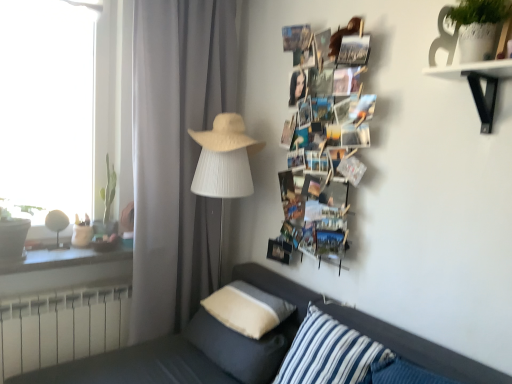
Question: Is soft beige pillow at lower center, positioned as the 2th pillow in front-to-back order, at the left side of matte white table lamp at left, which is the 2th table lamp in right-to-left order?

Choices:
 (A) yes
 (B) no

Answer: (B)

Question: Is soft beige pillow at lower center, positioned as the 2th pillow in front-to-back order, next to matte white table lamp at left, placed as the 1th table lamp when sorted from left to right?

Choices:
 (A) yes
 (B) no

Answer: (B)

Question: Does soft beige pillow at lower center, positioned as the 2th pillow in front-to-back order, contain matte white table lamp at left, which is the 2th table lamp in right-to-left order?

Choices:
 (A) yes
 (B) no

Answer: (B)

Question: Does soft beige pillow at lower center, the second pillow when ordered from back to front, come in front of matte white table lamp at left, which is the 2th table lamp in right-to-left order?

Choices:
 (A) no
 (B) yes

Answer: (B)

Question: Is soft beige pillow at lower center, positioned as the 2th pillow in front-to-back order, wider than matte white table lamp at left, placed as the 1th table lamp when sorted from left to right?

Choices:
 (A) yes
 (B) no

Answer: (A)

Question: Is gray matte curtain at center spatially inside matte wood window sill at left, or outside of it?

Choices:
 (A) outside
 (B) inside

Answer: (A)

Question: In terms of size, does gray matte curtain at center appear bigger or smaller than matte wood window sill at left?

Choices:
 (A) small
 (B) big

Answer: (B)

Question: From the image's perspective, is gray matte curtain at center located above or below matte wood window sill at left?

Choices:
 (A) above
 (B) below

Answer: (A)

Question: From a real-world perspective, is gray matte curtain at center physically located above or below matte wood window sill at left?

Choices:
 (A) above
 (B) below

Answer: (A)

Question: Considering the positions of beige woven fedora at center and blue striped pillow at lower center, placed as the 3th pillow when sorted from back to front, in the image, is beige woven fedora at center bigger or smaller than blue striped pillow at lower center, placed as the 3th pillow when sorted from back to front,?

Choices:
 (A) small
 (B) big

Answer: (A)

Question: Considering the positions of point (240, 140) and point (306, 337), is point (240, 140) closer or farther from the camera than point (306, 337)?

Choices:
 (A) closer
 (B) farther

Answer: (B)

Question: From their relative heights in the image, would you say beige woven fedora at center is taller or shorter than blue striped pillow at lower center, acting as the 1th pillow starting from the front?

Choices:
 (A) short
 (B) tall

Answer: (A)

Question: Is beige woven fedora at center wider or thinner than blue striped pillow at lower center, acting as the 1th pillow starting from the front?

Choices:
 (A) wide
 (B) thin

Answer: (A)

Question: Based on their sizes in the image, would you say beige woven fedora at center is bigger or smaller than gray matte curtain at center?

Choices:
 (A) big
 (B) small

Answer: (B)

Question: Looking at their shapes, would you say beige woven fedora at center is wider or thinner than gray matte curtain at center?

Choices:
 (A) thin
 (B) wide

Answer: (B)